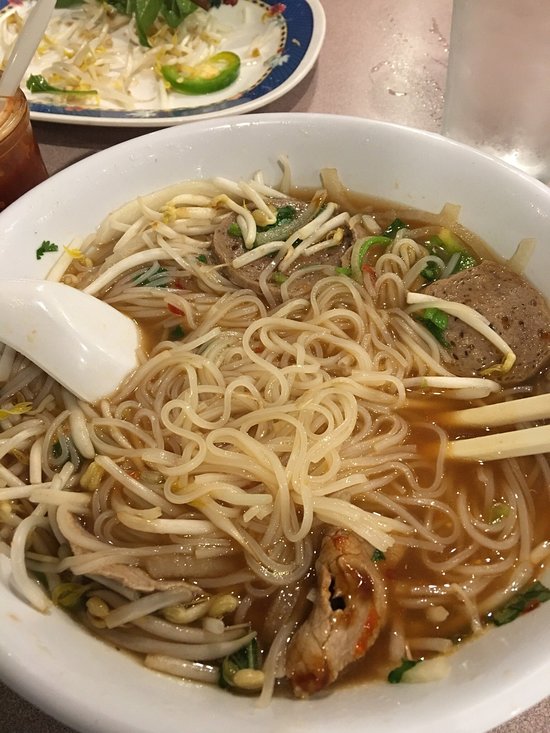
This screenshot has width=550, height=733. Identify the location of chopstick. (502, 402), (507, 442).